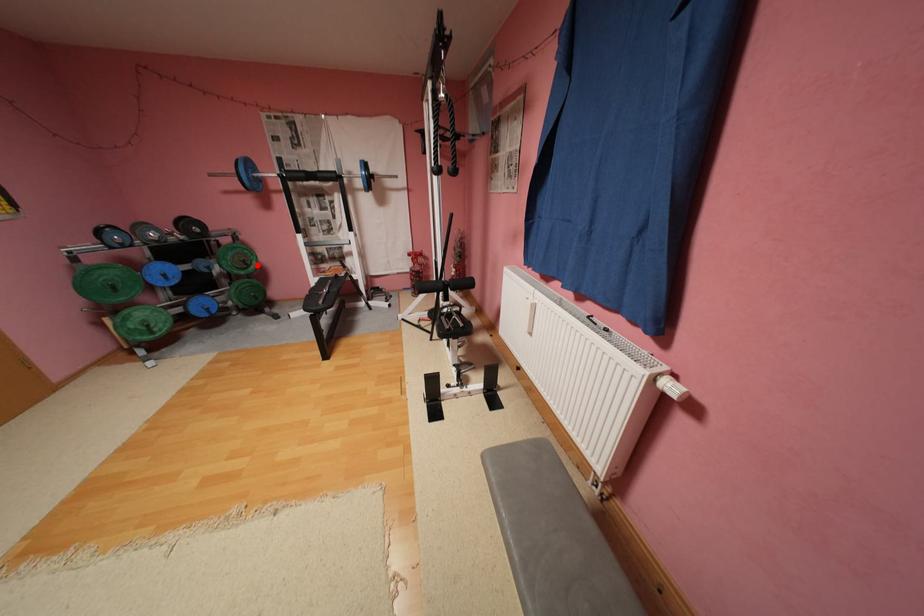
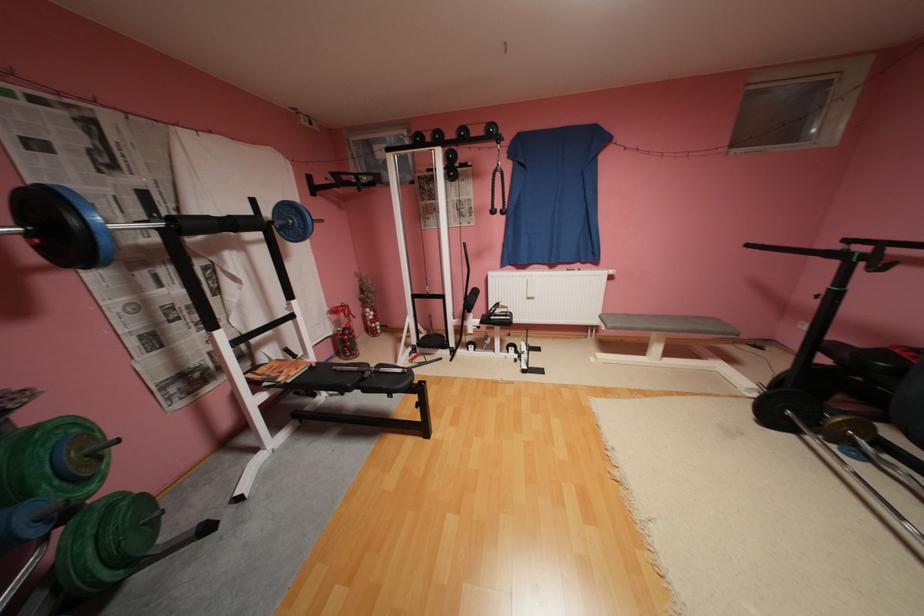
Question: I am providing you with two images of the same scene from different viewpoints. Image1 has a red point marked. In image2, the corresponding 3D location appears at what relative position? Reply with the corresponding letter.

Choices:
 (A) Closer
 (B) Farther

Answer: (B)